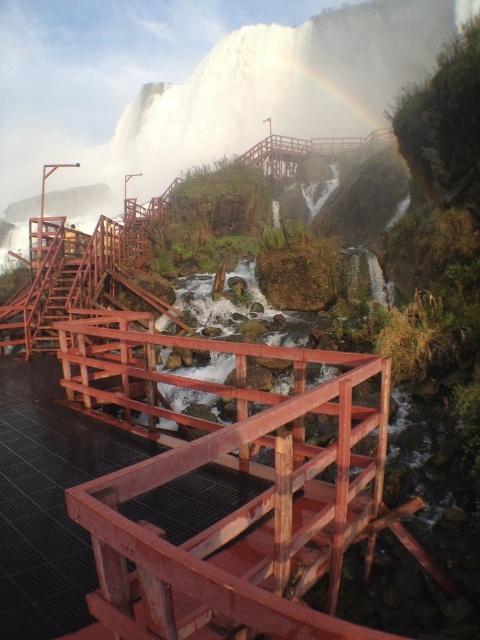
Question: Is matte red wooden rail at center smaller than wooden bridge at center?

Choices:
 (A) yes
 (B) no

Answer: (A)

Question: Which point is farther from the camera taking this photo?

Choices:
 (A) (252, 148)
 (B) (194, 595)

Answer: (A)

Question: Is matte red wooden rail at center to the right of wooden bridge at center from the viewer's perspective?

Choices:
 (A) no
 (B) yes

Answer: (A)

Question: Is matte red wooden rail at center positioned before wooden bridge at center?

Choices:
 (A) yes
 (B) no

Answer: (A)

Question: Which object appears closest to the camera in this image?

Choices:
 (A) wooden bridge at center
 (B) matte red wooden rail at center

Answer: (B)